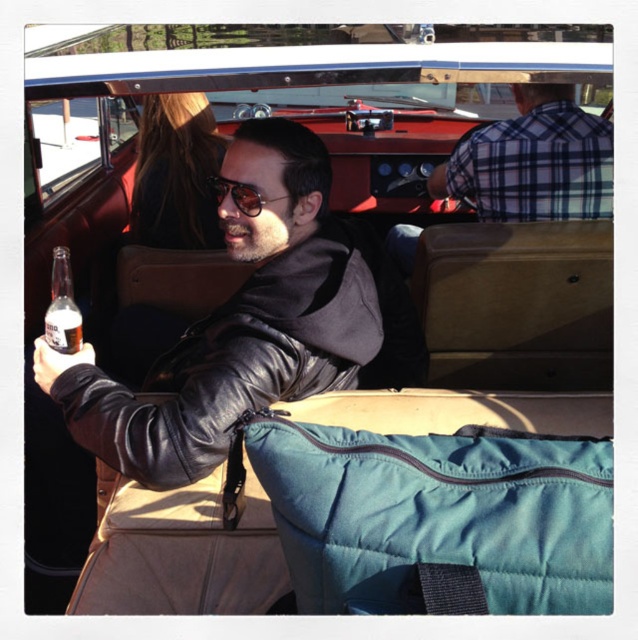
Question: From the image, what is the correct spatial relationship of clear glass bottle at center in relation to sunglasses at center?

Choices:
 (A) above
 (B) below

Answer: (B)

Question: Which point is closer to the camera?

Choices:
 (A) (52, 260)
 (B) (597, 145)

Answer: (A)

Question: Among these points, which one is farthest from the camera?

Choices:
 (A) (63, 269)
 (B) (579, 129)
 (C) (48, 337)

Answer: (B)

Question: Can you confirm if leather jacket at center is wider than clear glass bottle at center?

Choices:
 (A) no
 (B) yes

Answer: (B)

Question: Is the position of clear glass bottle at left more distant than that of sunglasses at center?

Choices:
 (A) yes
 (B) no

Answer: (B)

Question: Which point appears closest to the camera in this image?

Choices:
 (A) [70, 262]
 (B) [57, 344]
 (C) [595, 170]
 (D) [241, 188]

Answer: (B)